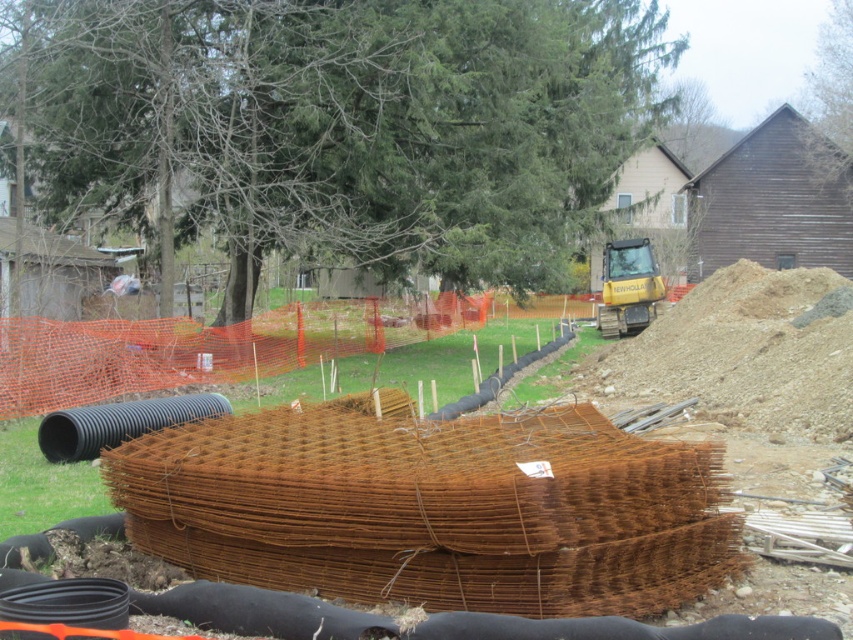
From the picture: Which of these two, brown gravel pile at right or yellow rubber at center, stands shorter?

Standing shorter between the two is yellow rubber at center.

Which is above, brown gravel pile at right or yellow rubber at center?

yellow rubber at center is higher up.

Describe the element at coordinates (741, 353) in the screenshot. Image resolution: width=853 pixels, height=640 pixels. I see `brown gravel pile at right` at that location.

At what (x,y) coordinates should I click in order to perform the action: click on brown gravel pile at right. Please return your answer as a coordinate pair (x, y). The width and height of the screenshot is (853, 640). Looking at the image, I should click on (741, 353).

In the scene shown: Which of these two, rusty wire mesh at center or brown gravel pile at right, stands shorter?

Standing shorter between the two is brown gravel pile at right.

Looking at this image, is rusty wire mesh at center shorter than brown gravel pile at right?

No, rusty wire mesh at center is not shorter than brown gravel pile at right.

Identify the location of rusty wire mesh at center. (746, 371).

Can you confirm if rusty wire mesh at center is positioned to the left of yellow rubber at center?

Yes, rusty wire mesh at center is to the left of yellow rubber at center.

Consider the image. Is rusty wire mesh at center above yellow rubber at center?

Actually, rusty wire mesh at center is below yellow rubber at center.

Does point (801, 410) lie behind point (631, 257)?

No, (801, 410) is closer to viewer.

Identify the location of rusty wire mesh at center. The width and height of the screenshot is (853, 640). (746, 371).